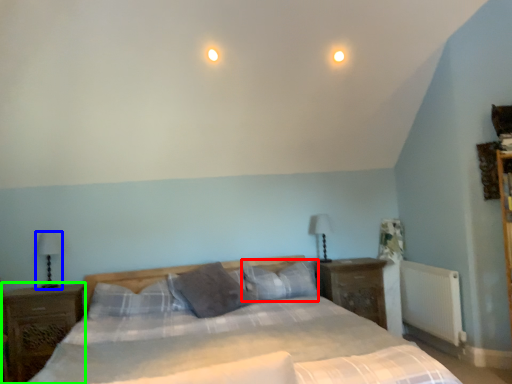
Question: Based on their relative distances, which object is nearer to pillow (highlighted by a red box)? Choose from table lamp (highlighted by a blue box) and nightstand (highlighted by a green box).

Choices:
 (A) table lamp
 (B) nightstand

Answer: (B)